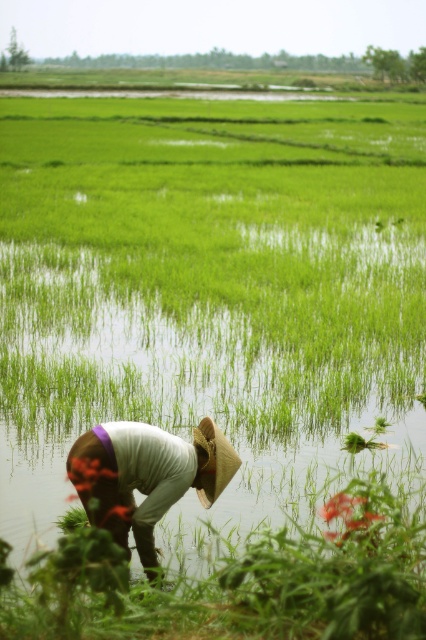
You are a drone operator trying to capture a photo of the person in the rice paddy. The drone is currently at a position above the white cotton shirt at lower center. To ensure the entire scene is visible, should you move the drone to the left or right?

The white cotton shirt at lower center is positioned at point 0.744 on the x and 0.343 on the y axis. Since the shirt is at the lower center, moving the drone to the left would allow capturing more of the scene to the right side, but given the coordinates, it might be better to adjust based on the specific area needed. However, without additional spatial data, moving slightly to the left could provide a broader view.

You are a photographer standing at the camera position. You want to take a closeup shot of the white cotton shirt at lower center. What should you do to ensure the subject is in focus?

The white cotton shirt at lower center is 5.12 meters away from the camera. To ensure it is in focus, adjust the camera focus to 5.12 meters.